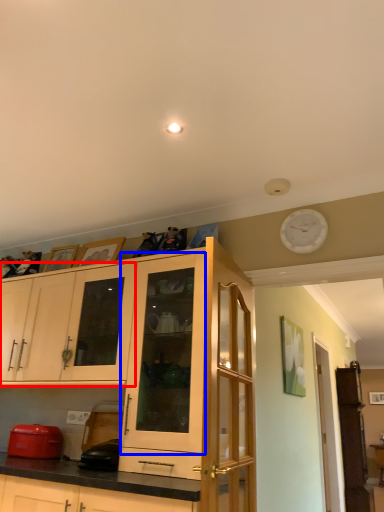
Question: Which object is further to the camera taking this photo, cabinetry (highlighted by a red box) or cabinetry (highlighted by a blue box)?

Choices:
 (A) cabinetry
 (B) cabinetry

Answer: (A)